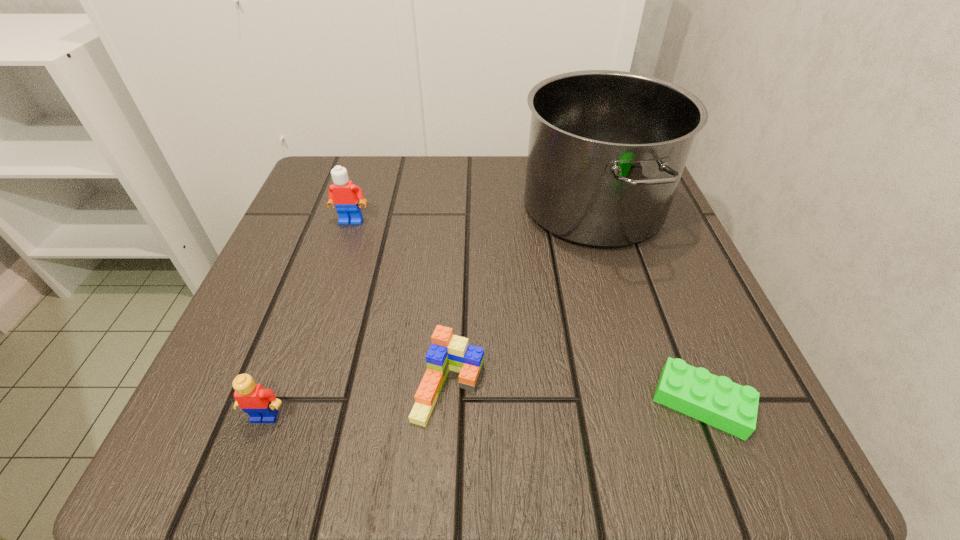
At what (x,y) coordinates should I click in order to perform the action: click on free region that satisfies the following two spatial constraints: 1. on the front side of the shortest object; 2. on the left side of the tallest object. Please return your answer as a coordinate pair (x, y). Looking at the image, I should click on (652, 402).

Locate an element on the screen. free region that satisfies the following two spatial constraints: 1. on the face of the third object from right to left; 2. on the right side of the farthest Lego is located at coordinates click(296, 388).

Where is `vacant space that satisfies the following two spatial constraints: 1. on the front side of the tallest object; 2. on the right side of the shortest object`? vacant space that satisfies the following two spatial constraints: 1. on the front side of the tallest object; 2. on the right side of the shortest object is located at coordinates coord(652,402).